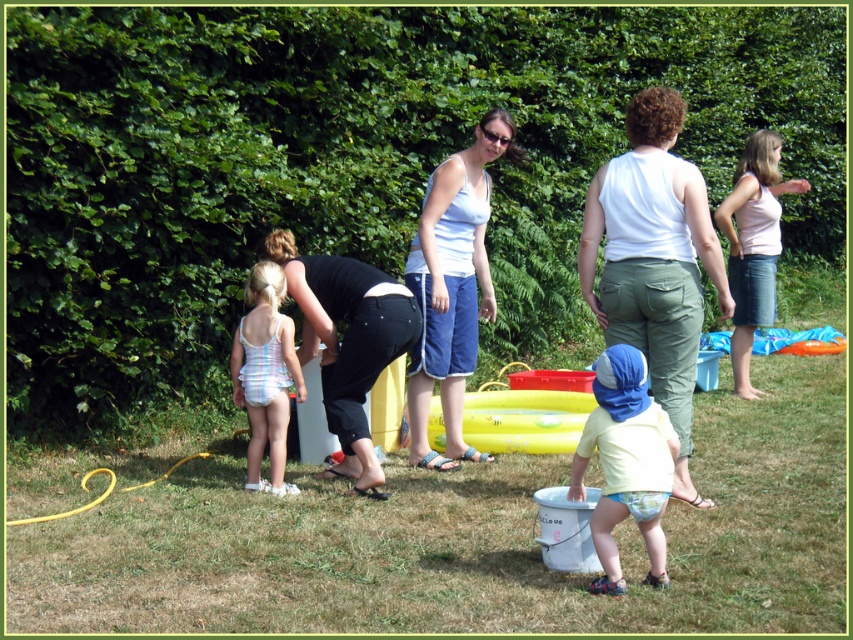
You are a photographer taking a picture of the yellow cotton shirt at center and the striped fabric swimsuit at center left. Which object should you focus on first if you want to capture both in the same frame without moving the camera?

The yellow cotton shirt at center should be focused on first because it is shorter than the striped fabric swimsuit at center left, allowing the camera to adjust focus starting from the closer object upwards.

You are standing in the outdoor scene and see the white cotton tank top at center and the pink cotton tank top at upper right. Which one is closer to the ground?

The white cotton tank top at center is closer to the ground because it is below the pink cotton tank top at upper right.

You are a fashion designer observing the outdoor scene. You notice two tank tops worn by individuals in the image. Which tank top is taller in height between the white cotton tank top at center and the pink cotton tank top at upper right?

The white cotton tank top at center has a greater height compared to the pink cotton tank top at upper right, so the white cotton tank top at center is taller.